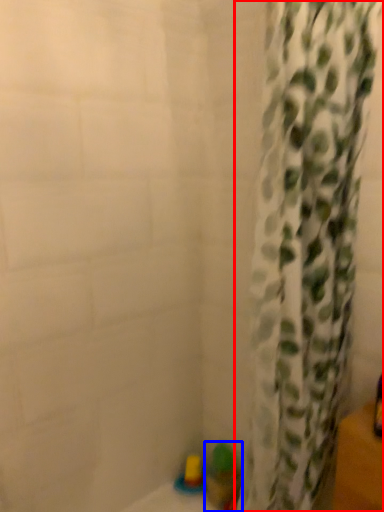
Question: Among these objects, which one is farthest to the camera, curtain (highlighted by a red box) or toy (highlighted by a blue box)?

Choices:
 (A) curtain
 (B) toy

Answer: (B)